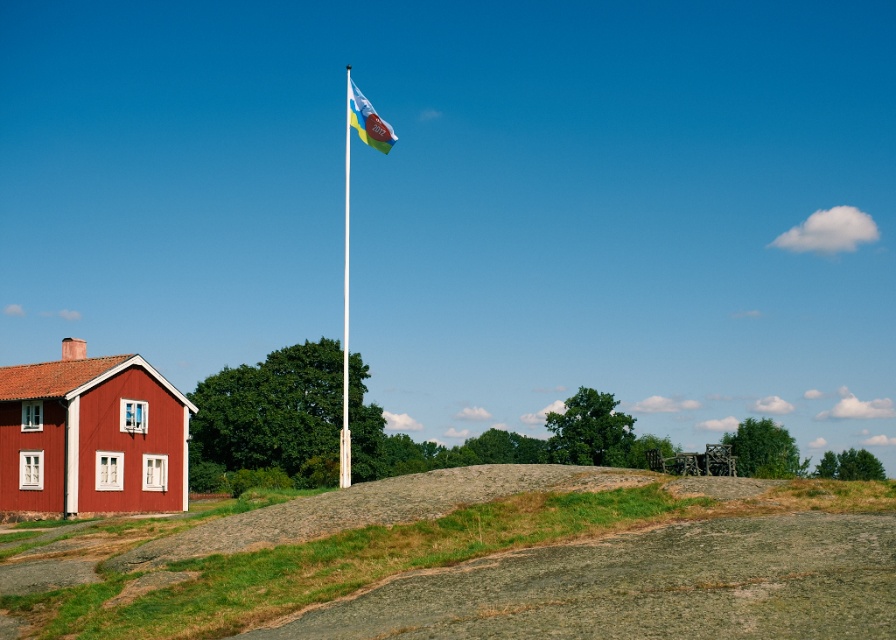
Question: Does white glossy flag pole at center appear under polyester flag at upper center?

Choices:
 (A) yes
 (B) no

Answer: (A)

Question: Can you confirm if white glossy flag pole at center is positioned above polyester flag at upper center?

Choices:
 (A) yes
 (B) no

Answer: (B)

Question: Is white glossy flag pole at center to the left of polyester flag at upper center from the viewer's perspective?

Choices:
 (A) no
 (B) yes

Answer: (B)

Question: Which point appears farthest from the camera in this image?

Choices:
 (A) (347, 410)
 (B) (360, 100)

Answer: (A)

Question: Which of the following is the farthest from the observer?

Choices:
 (A) (343, 372)
 (B) (350, 96)

Answer: (B)

Question: Which point appears closest to the camera in this image?

Choices:
 (A) (346, 90)
 (B) (360, 96)

Answer: (A)